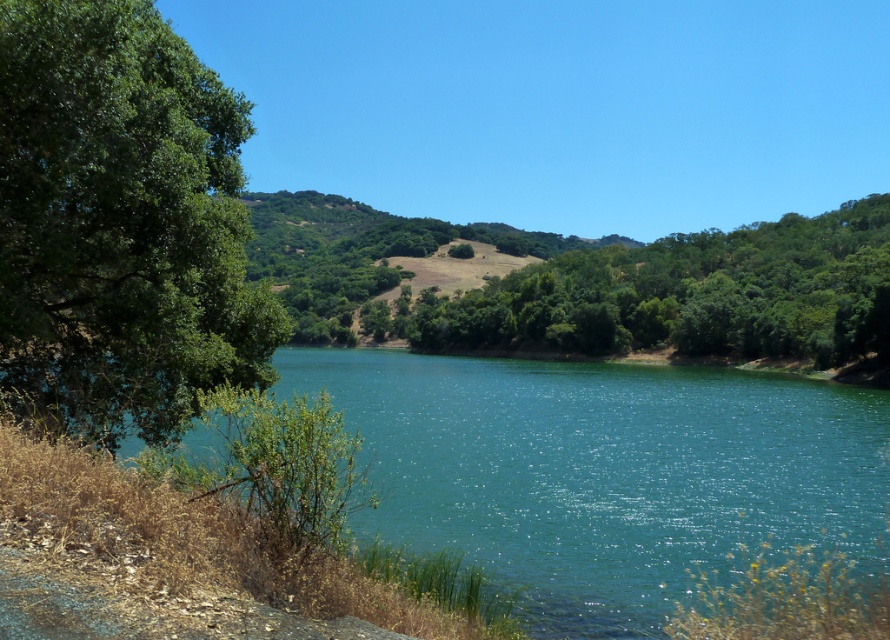
Based on the photo, between green leafy tree at left and green leafy tree at center, which one has less height?

With less height is green leafy tree at left.

Is green leafy tree at left above green leafy tree at center?

No.

Is point (96, 1) positioned before point (829, 353)?

Yes.

You are a GUI agent. You are given a task and a screenshot of the screen. Output one action in this format:
    pyautogui.click(x=<x>, y=<y>)
    Task: Click on the green leafy tree at left
    
    Given the screenshot: What is the action you would take?
    pyautogui.click(x=120, y=225)

Who is lower down, teal glossy water at center or green leafy tree at center?

teal glossy water at center is below.

From the picture: Is teal glossy water at center above green leafy tree at center?

No.

Between point (508, 465) and point (516, 316), which one is positioned in front?

Point (508, 465) is more forward.

This screenshot has width=890, height=640. I want to click on teal glossy water at center, so click(604, 472).

Is green leafy tree at left shorter than green leafy hillside at center?

Indeed, green leafy tree at left has a lesser height compared to green leafy hillside at center.

Does green leafy tree at left have a greater height compared to green leafy hillside at center?

In fact, green leafy tree at left may be shorter than green leafy hillside at center.

Which is behind, point (62, 44) or point (344, 339)?

Positioned behind is point (344, 339).

Where is `green leafy tree at left`? This screenshot has height=640, width=890. green leafy tree at left is located at coordinates click(120, 225).